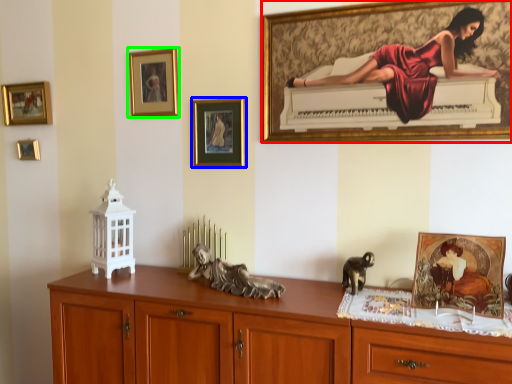
Question: Which object is the closest to the picture frame (highlighted by a red box)? Choose among these: picture frame (highlighted by a blue box) or picture frame (highlighted by a green box).

Choices:
 (A) picture frame
 (B) picture frame

Answer: (A)